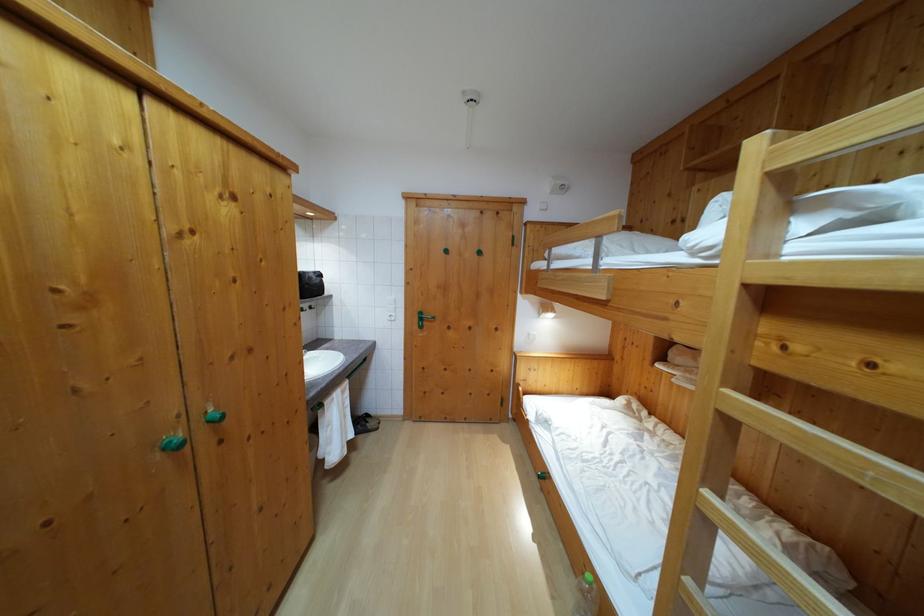
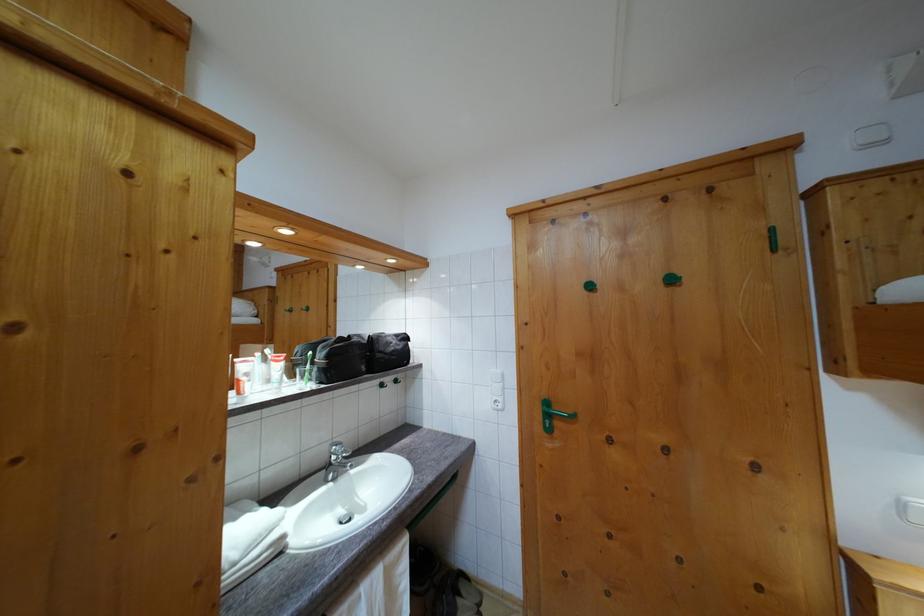
Question: The images are taken continuously from a first-person perspective. In which direction is your viewpoint rotating?

Choices:
 (A) Left
 (B) Right
 (C) Up
 (D) Down

Answer: (A)